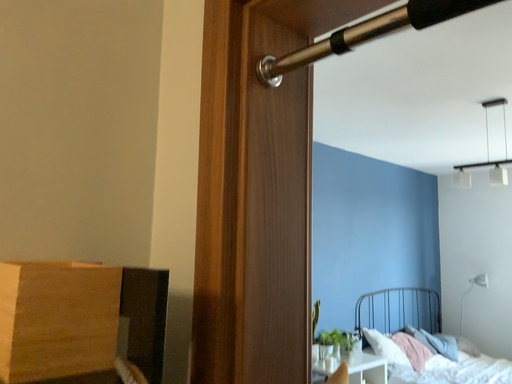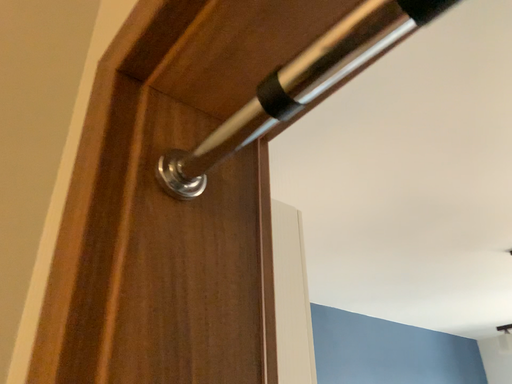
Question: How did the camera likely rotate when shooting the video?

Choices:
 (A) rotated downward
 (B) rotated upward

Answer: (B)